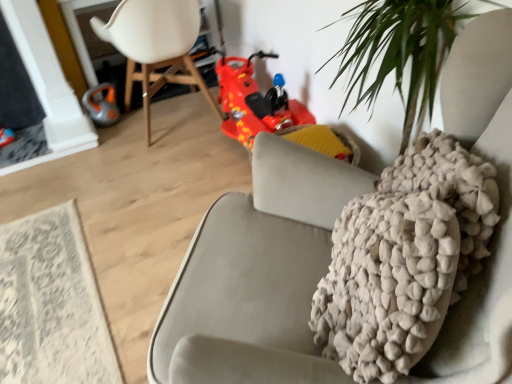
I want to click on vacant space that's between white plastic chair at upper left and shiny red plastic toy car at center, so click(x=207, y=151).